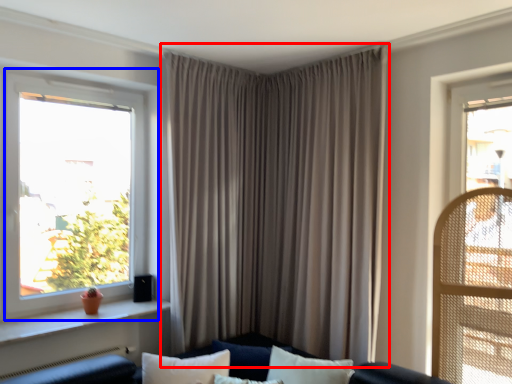
Question: Which object appears farthest to the camera in this image, curtain (highlighted by a red box) or window (highlighted by a blue box)?

Choices:
 (A) curtain
 (B) window

Answer: (A)